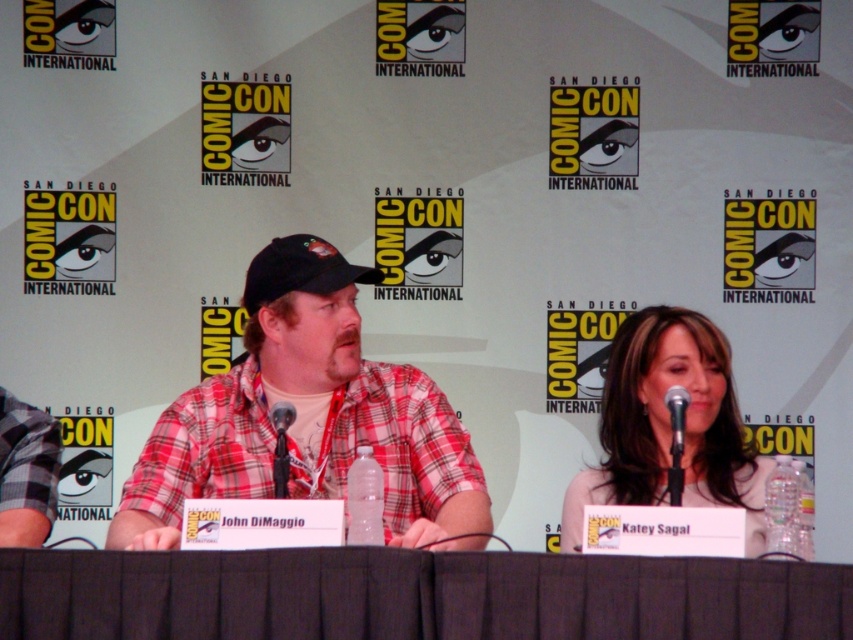
Question: Which object is positioned farthest from the smooth beige blouse at center?

Choices:
 (A) black fabric baseball cap at center
 (B) black metallic microphone at center
 (C) black plastic microphone at center

Answer: (C)

Question: Can you confirm if black fabric table at center is positioned below plaid shirt at center?

Choices:
 (A) no
 (B) yes

Answer: (B)

Question: Which point is closer to the camera?

Choices:
 (A) (676, 449)
 (B) (254, 291)

Answer: (A)

Question: From the image, what is the correct spatial relationship of black fabric table at center in relation to black metallic microphone at center?

Choices:
 (A) right
 (B) left

Answer: (B)

Question: Which point appears closest to the camera in this image?

Choices:
 (A) (294, 410)
 (B) (334, 259)

Answer: (A)

Question: Is plaid shirt at center smaller than black fabric baseball cap at center?

Choices:
 (A) no
 (B) yes

Answer: (A)